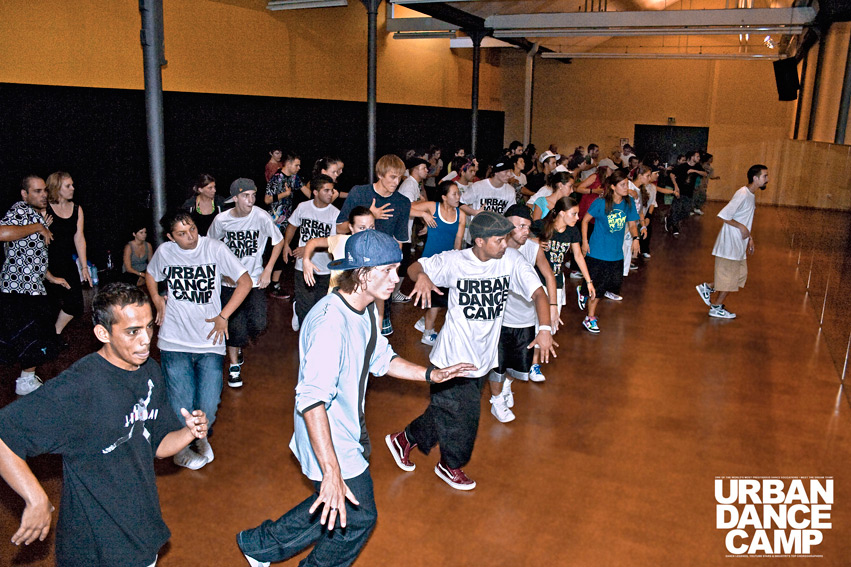
Where is `mirrors`? The width and height of the screenshot is (851, 567). mirrors is located at coordinates (841, 331), (808, 287), (785, 202), (809, 228).